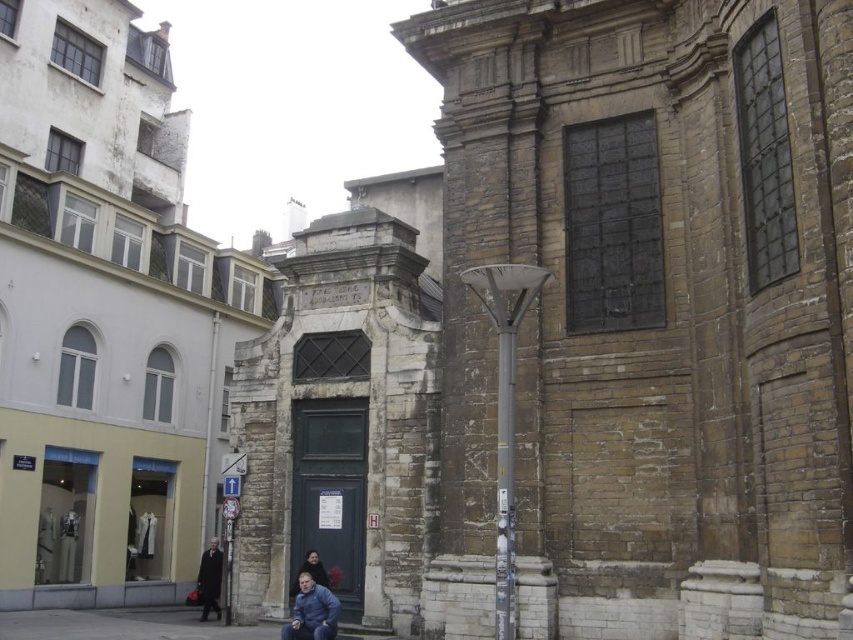
You are a customer trying to choose between two coats displayed in a store window. The coats are the blue denim jacket at lower center and the dark brown leather coat at lower left. Which coat is narrower in width?

The blue denim jacket at lower center is narrower in width compared to the dark brown leather coat at lower left.

You are a delivery person who needs to place a large package on the ground. The package is too heavy to lift, so you must choose between the gray concrete pavement at lower center and the dark brown leather coat at lower left. Which surface is more suitable for placing the package?

The gray concrete pavement at lower center is bigger than the dark brown leather coat at lower left, so it is more suitable for placing the large package as it can accommodate the package size better.

Based on the photo, you are standing on the sidewalk in the urban street scene. You see a blue denim jacket at lower center. Where exactly is the blue denim jacket located in terms of coordinates?

The blue denim jacket at lower center is located at coordinates point (311, 611).